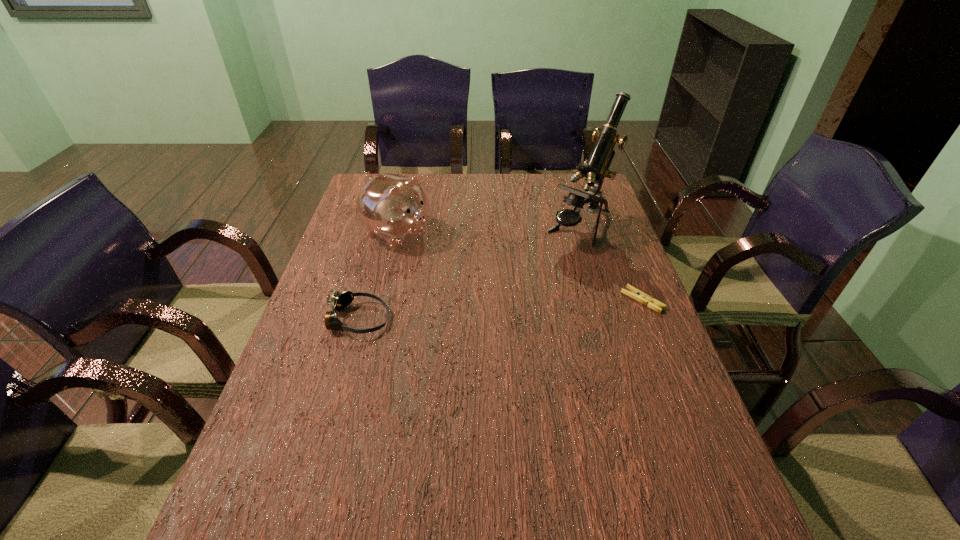
In the image, there is a desktop. At what (x,y) coordinates should I click in order to perform the action: click on blank space at the far left corner. Please return your answer as a coordinate pair (x, y). Looking at the image, I should click on (366, 180).

Locate an element on the screen. This screenshot has width=960, height=540. empty space between the clothespin and the second tallest object is located at coordinates (519, 267).

The width and height of the screenshot is (960, 540). I want to click on empty space that is in between the clothespin and the tallest object, so click(612, 265).

The width and height of the screenshot is (960, 540). Find the location of `empty location between the microscope and the second tallest object`. empty location between the microscope and the second tallest object is located at coordinates (489, 231).

Identify the location of free area in between the piggy bank and the microscope. This screenshot has height=540, width=960. (489, 231).

Where is `free space between the piggy bank and the third tallest object`? The image size is (960, 540). free space between the piggy bank and the third tallest object is located at coordinates (377, 276).

Find the location of `vacant area between the shortest object and the tallest object`. vacant area between the shortest object and the tallest object is located at coordinates (612, 265).

This screenshot has width=960, height=540. I want to click on vacant point located between the second tallest object and the microscope, so click(489, 231).

Where is `free spot between the goggles and the piggy bank`? free spot between the goggles and the piggy bank is located at coordinates (377, 276).

Locate an element on the screen. vacant space in between the tallest object and the goggles is located at coordinates point(469,274).